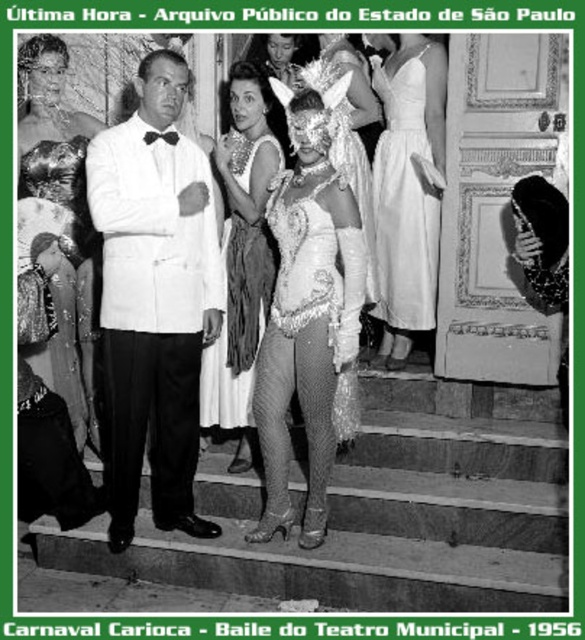
Based on the coordinates provided, where exactly is the sequined fabric dress at left located in the image?

The sequined fabric dress at left is located at point coordinates of 0.341 on the x axis and 0.101 on the y axis.